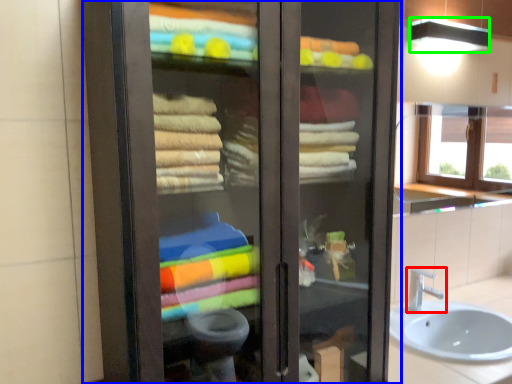
Question: Estimate the real-world distances between objects in this image. Which object is closer to tap (highlighted by a red box), bathroom cabinet (highlighted by a blue box) or shower (highlighted by a green box)?

Choices:
 (A) bathroom cabinet
 (B) shower

Answer: (B)